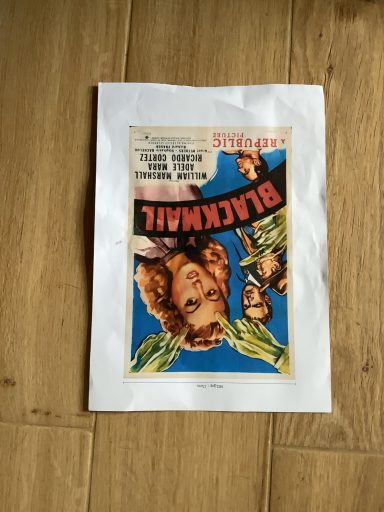
Measure the distance between matte paper poster at center and camera.

The distance of matte paper poster at center from camera is 14.45 inches.

You are a GUI agent. You are given a task and a screenshot of the screen. Output one action in this format:
    pyautogui.click(x=<x>, y=<y>)
    Task: Click on the matte paper poster at center
    This screenshot has width=384, height=512.
    Given the screenshot: What is the action you would take?
    pyautogui.click(x=293, y=241)

The height and width of the screenshot is (512, 384). What do you see at coordinates (293, 241) in the screenshot? I see `matte paper poster at center` at bounding box center [293, 241].

I want to click on matte paper poster at center, so click(293, 241).